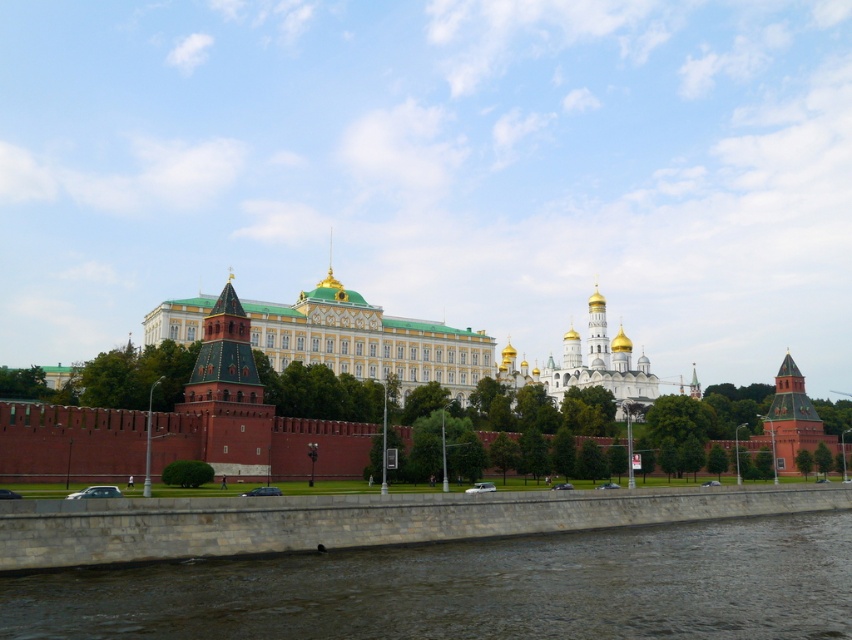
Which is below, stone embankment at lower center or white stone church at center?

stone embankment at lower center is below.

Between stone embankment at lower center and white stone church at center, which one appears on the left side from the viewer's perspective?

stone embankment at lower center is more to the left.

The height and width of the screenshot is (640, 852). Find the location of `stone embankment at lower center`. stone embankment at lower center is located at coordinates (357, 518).

Is point (709, 568) positioned before point (403, 356)?

Yes, point (709, 568) is in front of point (403, 356).

Is point (832, 529) positioned behind point (409, 348)?

No, (832, 529) is in front of (409, 348).

This screenshot has width=852, height=640. Identify the location of brown stone river at lower center. (471, 588).

Can you confirm if green matte building at center is thinner than green tiled tower at center-left?

No, green matte building at center is not thinner than green tiled tower at center-left.

Is point (355, 321) in front of point (226, 305)?

No, (355, 321) is further to viewer.

Is point (309, 310) closer to viewer compared to point (248, 376)?

No, it is behind (248, 376).

Image resolution: width=852 pixels, height=640 pixels. Find the location of `green matte building at center`. green matte building at center is located at coordinates (367, 339).